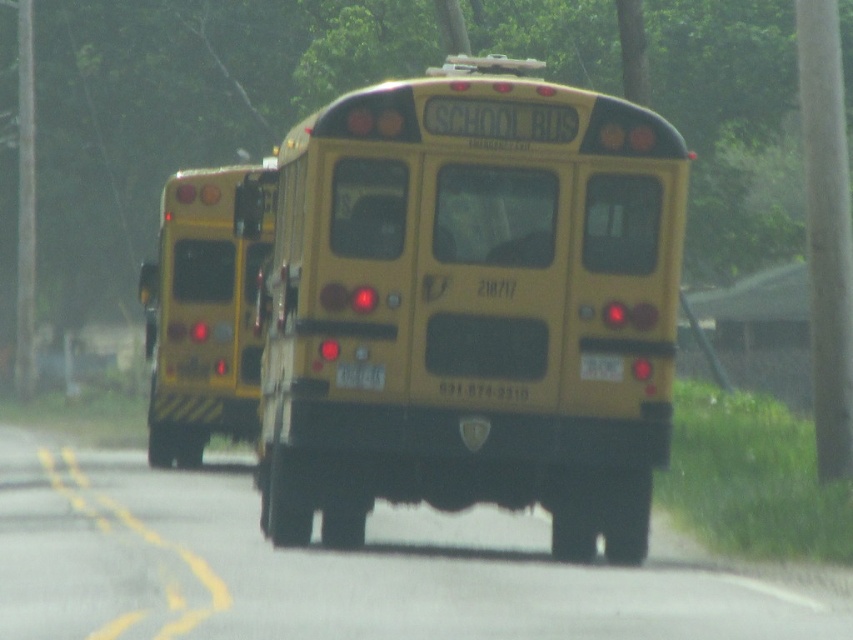
You are driving a car and want to safely overtake the yellow matte school bus at center. The yellow matte school bus at left is coming towards you. What is the minimum safe distance you should maintain between your car and both buses while passing?

The minimum safe distance should be at least 3.96 meters between your car and both buses to ensure safety while overtaking.

You are a pedestrian standing on the sidewalk and see the yellow matte school bus at center and the yellow matte license plate at center in the image. Which object is positioned to the right side from your viewpoint?

The yellow matte school bus at center is positioned to the right of the yellow matte license plate at center from your viewpoint.